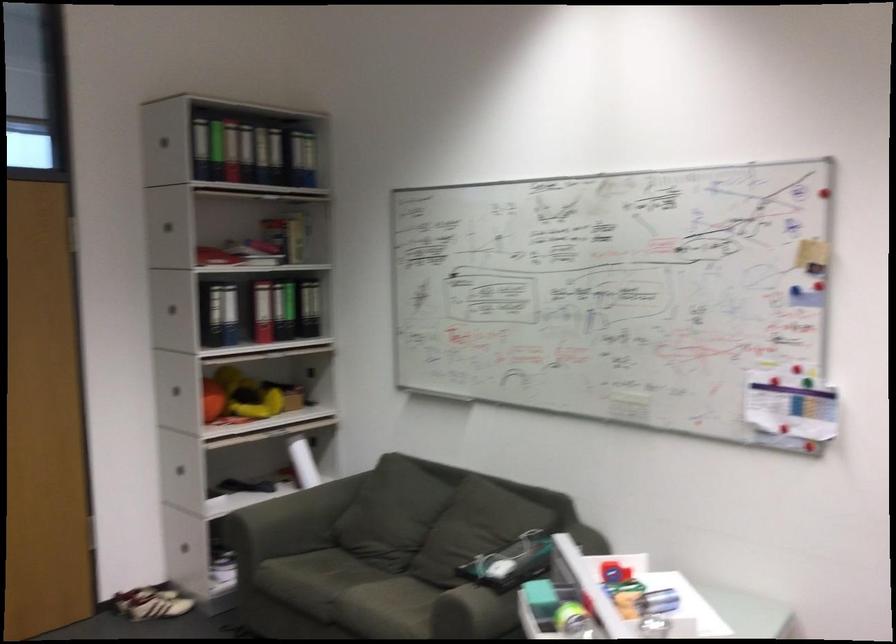
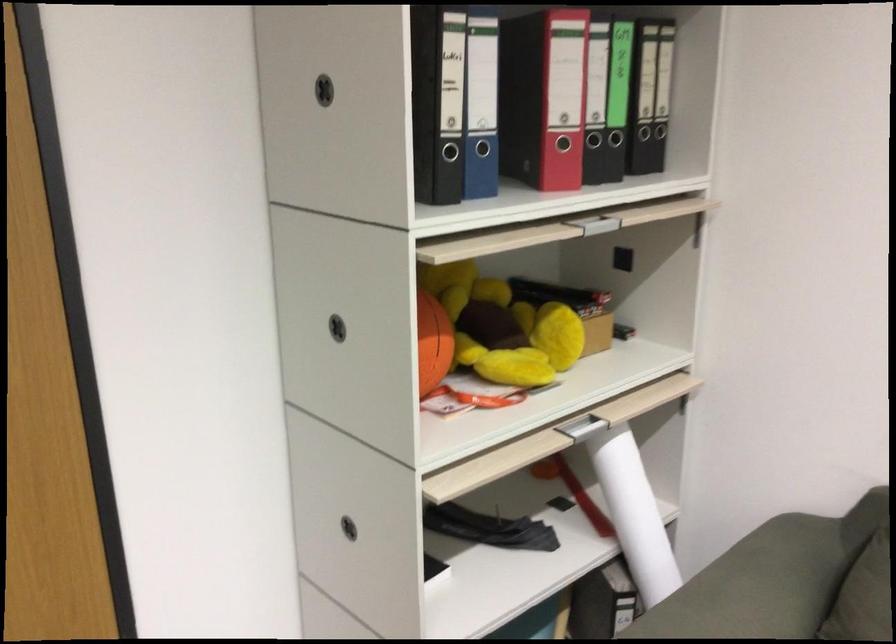
In the second image, find the point that corresponds to point (170, 401) in the first image.

(337, 328)